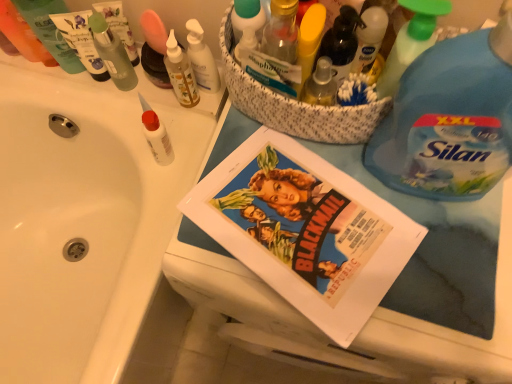
Image resolution: width=512 pixels, height=384 pixels. Find the location of `space that is in front of green plastic tube at upper left, arranged as the 2th toiletry when viewed from the left`. space that is in front of green plastic tube at upper left, arranged as the 2th toiletry when viewed from the left is located at coordinates (75, 99).